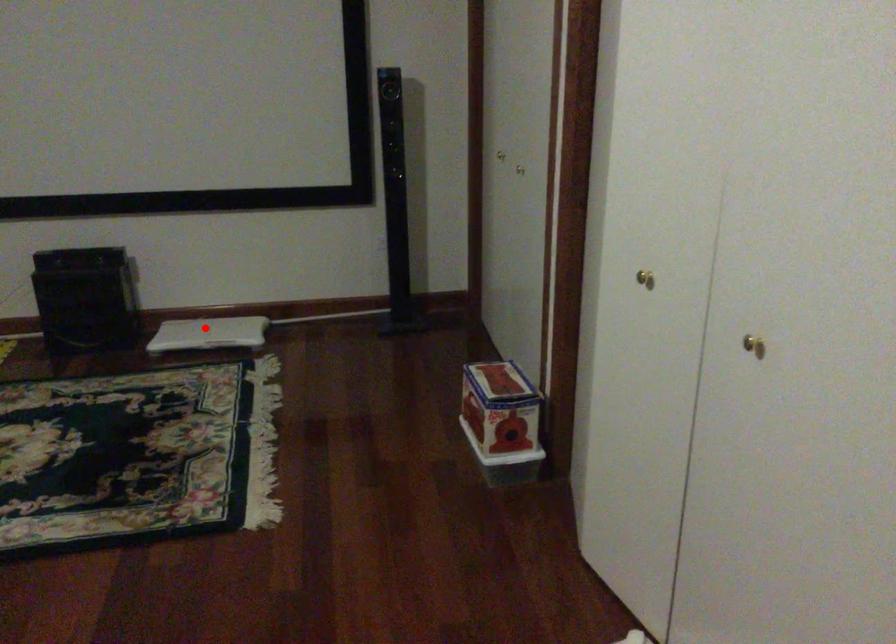
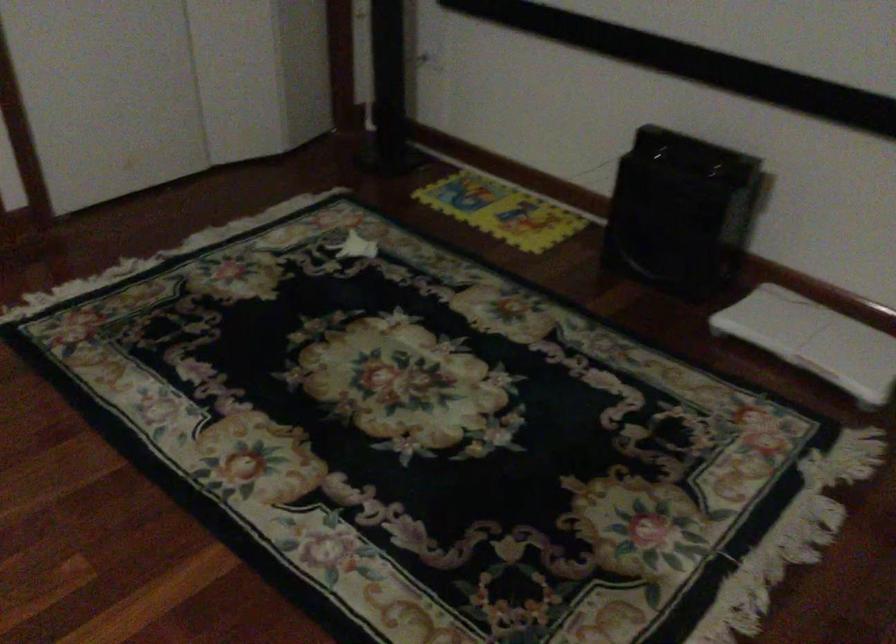
Question: I am providing you with two images of the same scene from different viewpoints. In image1, a red point is highlighted. Considering the same 3D point in image2, which of the following is correct?

Choices:
 (A) It is closer
 (B) It is farther

Answer: (A)